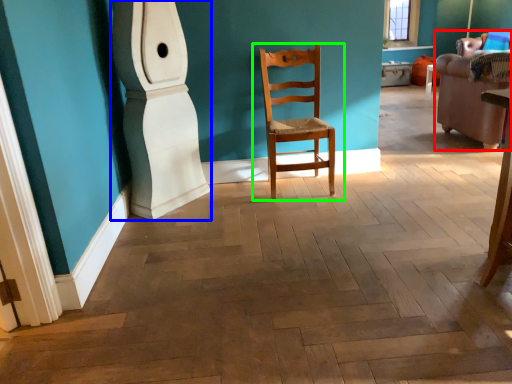
Question: Which object is positioned closest to armchair (highlighted by a red box)? Select from pillar (highlighted by a blue box) and chair (highlighted by a green box).

Choices:
 (A) pillar
 (B) chair

Answer: (B)